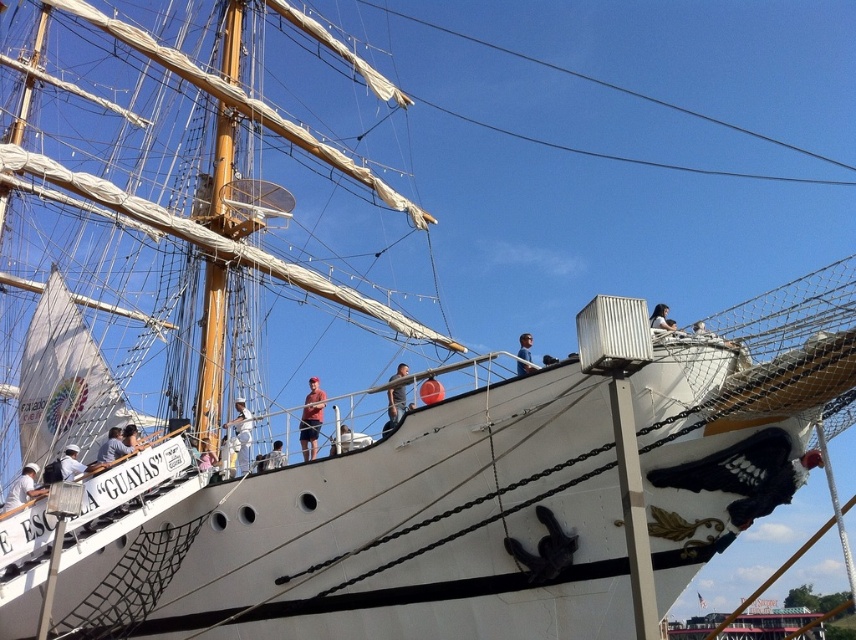
You are a sailor on the historic ship Guayas. You need to choose a shirt to wear for the captain inspection. Which shirt is smaller in size between the white matte shirt at upper left and the blue fabric shirt at upper center?

The white matte shirt at upper left is smaller in size compared to the blue fabric shirt at upper center.

You are standing on the deck of the ship and see two shirts hanging on a line between two masts. The shirts are the white matte shirt at upper left and the blue fabric shirt at upper center. Which shirt is closer to the left side of the ship?

The white matte shirt at upper left is closer to the left side of the ship because it is positioned to the left of the blue fabric shirt at upper center.